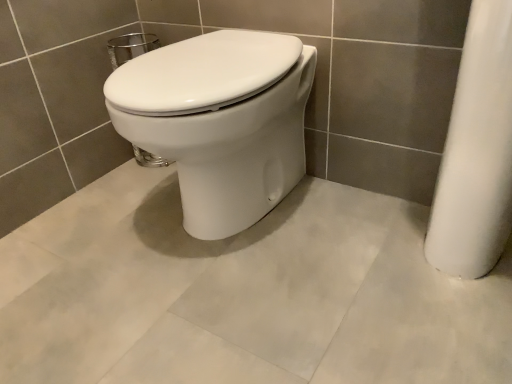
At what (x,y) coordinates should I click in order to perform the action: click on free space in front of white glossy toilet at center. Please return your answer as a coordinate pair (x, y). The height and width of the screenshot is (384, 512). Looking at the image, I should click on (231, 311).